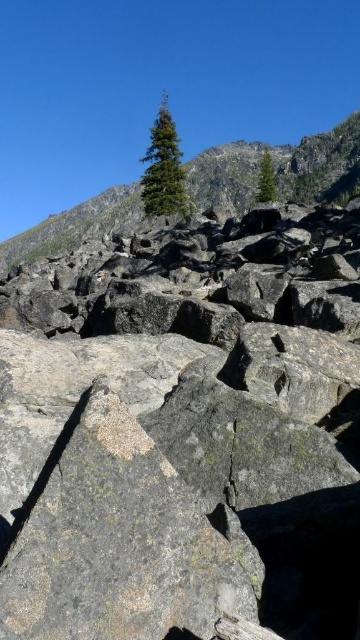
Who is lower down, gray granite rock at center or green coniferous tree at upper center?

gray granite rock at center

The image size is (360, 640). What are the coordinates of `gray granite rock at center` in the screenshot? It's located at (185, 433).

Where is `gray granite rock at center`? gray granite rock at center is located at coordinates (185, 433).